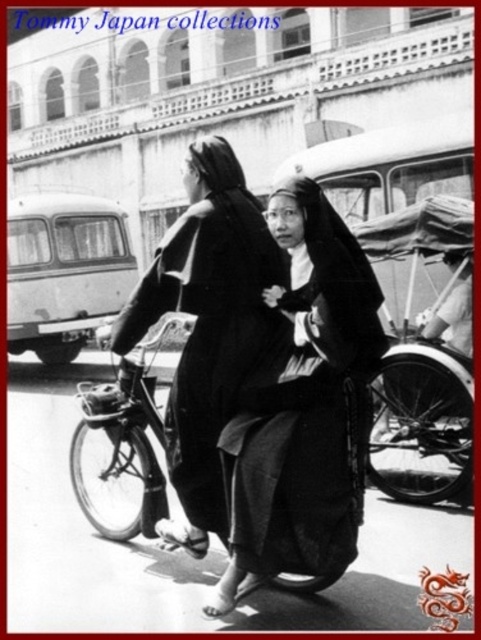
Question: Does black matte robe at center appear on the right side of smooth black robe at center?

Choices:
 (A) yes
 (B) no

Answer: (A)

Question: Which of these objects is positioned closest to the metallic bicycle at center?

Choices:
 (A) smooth black robe at center
 (B) wooden rickshaw at center
 (C) black matte robe at center

Answer: (A)

Question: Does smooth black robe at center have a smaller size compared to wooden rickshaw at center?

Choices:
 (A) yes
 (B) no

Answer: (B)

Question: Which object is positioned farthest from the black matte robe at center?

Choices:
 (A) smooth black robe at center
 (B) wooden rickshaw at center

Answer: (B)

Question: Among these objects, which one is farthest from the camera?

Choices:
 (A) smooth black robe at center
 (B) black matte robe at center

Answer: (A)

Question: Is black matte robe at center below metallic bicycle at center?

Choices:
 (A) yes
 (B) no

Answer: (B)